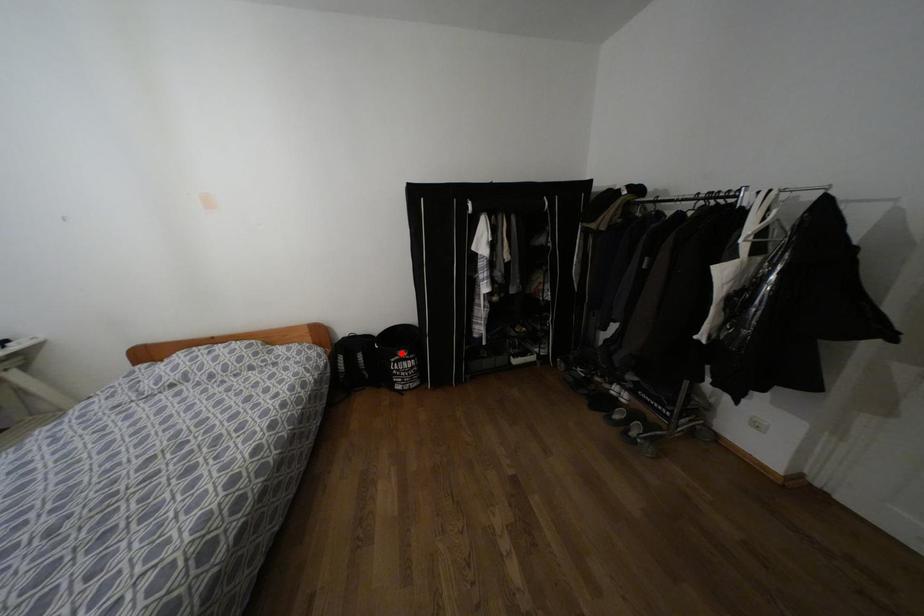
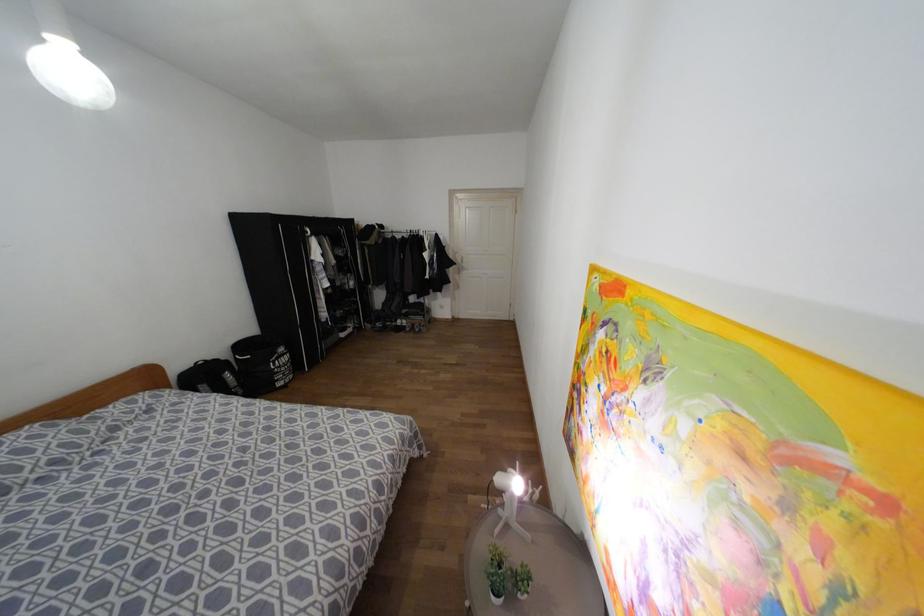
Question: I am providing you with two images of the same scene from different viewpoints. In image1, a red point is highlighted. Considering the same 3D point in image2, which of the following is correct?

Choices:
 (A) It is closer
 (B) It is farther

Answer: (A)